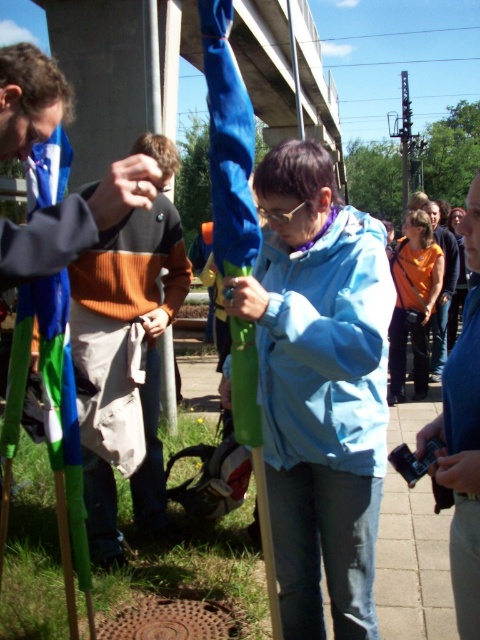
You are organizing an outdoor event and need to determine which clothing item has a larger size between the light blue fabric jacket at center and the orange fabric at right. Based on the scene description, which one is bigger?

The orange fabric at right is larger than the light blue fabric jacket at center according to the description.

You are a photographer at the event and want to capture a photo that includes both the matte black jacket at left and the orange fabric at right. Which object should you focus on first to ensure both are in the frame?

You should focus on the matte black jacket at left first because it is closer to the viewer than the orange fabric at right, ensuring both are in the frame.